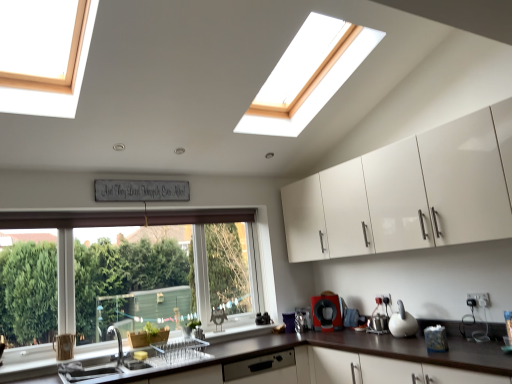
What do you see at coordinates (302, 320) in the screenshot? The width and height of the screenshot is (512, 384). I see `metallic silver kettle at center right, the third appliance viewed from the front` at bounding box center [302, 320].

What do you see at coordinates (371, 347) in the screenshot? The height and width of the screenshot is (384, 512). I see `brown matte countertop at lower left` at bounding box center [371, 347].

Where is `white glossy kettle at right, the third appliance viewed from the back`? white glossy kettle at right, the third appliance viewed from the back is located at coordinates click(x=402, y=323).

From the picture: In order to face black matte coffee maker at lower center, placed as the second appliance when sorted from front to back, should I rotate leftwards or rightwards?

You should look right and rotate roughly 9.421 degrees.

The width and height of the screenshot is (512, 384). What do you see at coordinates (262, 369) in the screenshot? I see `satin silver dishwasher at lower center` at bounding box center [262, 369].

Identify the location of matte stainless steel sink at lower left. (91, 370).

Based on the photo, does white glossy cabinet at upper right have a lesser width compared to matte stainless steel sink at lower left?

Yes.

From the image's perspective, between white glossy cabinet at upper right and matte stainless steel sink at lower left, who is located below?

matte stainless steel sink at lower left.

From the picture: Is white glossy cabinet at upper right looking in the opposite direction of matte stainless steel sink at lower left?

No, white glossy cabinet at upper right is not facing away from matte stainless steel sink at lower left.

Based on the photo, who is bigger, white glossy cabinet at upper right or matte stainless steel sink at lower left?

With larger size is white glossy cabinet at upper right.

From the image's perspective, is clear glass window at lower left below brown matte countertop at lower left?

Actually, clear glass window at lower left appears above brown matte countertop at lower left in the image.

Which is in front, point (48, 218) or point (443, 320)?

Point (443, 320)

Can you confirm if clear glass window at lower left is positioned to the right of brown matte countertop at lower left?

In fact, clear glass window at lower left is to the left of brown matte countertop at lower left.

Measure the distance from clear glass window at lower left to brown matte countertop at lower left.

The distance of clear glass window at lower left from brown matte countertop at lower left is 3.28 feet.

Considering the sizes of objects silver metallic tap at lower left and brown matte countertop at lower left in the image provided, who is bigger, silver metallic tap at lower left or brown matte countertop at lower left?

Bigger between the two is brown matte countertop at lower left.

Is brown matte countertop at lower left completely or partially inside silver metallic tap at lower left?

No, silver metallic tap at lower left does not contain brown matte countertop at lower left.

Considering the relative positions of silver metallic tap at lower left and brown matte countertop at lower left in the image provided, is silver metallic tap at lower left in front of brown matte countertop at lower left?

No, silver metallic tap at lower left is further to the viewer.

Could matte stainless steel sink at lower left be considered to be inside clear glass window at lower left?

No, clear glass window at lower left does not contain matte stainless steel sink at lower left.

Considering the positions of objects clear glass window at lower left and matte stainless steel sink at lower left in the image provided, who is more to the right, clear glass window at lower left or matte stainless steel sink at lower left?

clear glass window at lower left is more to the right.

Who is taller, clear glass window at lower left or matte stainless steel sink at lower left?

Answer: With more height is clear glass window at lower left.

Measure the distance from white glossy cabinet at upper right to white glossy kettle at right, the 3th appliance positioned from the left.

A distance of 33.26 inches exists between white glossy cabinet at upper right and white glossy kettle at right, the 3th appliance positioned from the left.

Does white glossy cabinet at upper right touch white glossy kettle at right, the 3th appliance positioned from the left?

They are not placed beside each other.

Does point (321, 257) come closer to viewer compared to point (407, 314)?

No, (321, 257) is behind (407, 314).

From the image's perspective, between white glossy cabinet at upper right and white glossy kettle at right, the 3th appliance positioned from the left, which one is located above?

white glossy cabinet at upper right.

Which is correct: black matte coffee maker at lower center, which is counted as the second appliance, starting from the left, is inside white glossy cabinet at upper right, or outside of it?

black matte coffee maker at lower center, which is counted as the second appliance, starting from the left, cannot be found inside white glossy cabinet at upper right.

Between point (328, 320) and point (373, 193), which one is positioned in front?

The point (373, 193) is more forward.

Considering their positions, is black matte coffee maker at lower center, placed as the second appliance when sorted from front to back, located in front of or behind white glossy cabinet at upper right?

In the image, black matte coffee maker at lower center, placed as the second appliance when sorted from front to back, appears behind white glossy cabinet at upper right.

How many degrees apart are the facing directions of satin silver dishwasher at lower center and white glossy kettle at right, the third appliance viewed from the back?

The angle between the facing direction of satin silver dishwasher at lower center and the facing direction of white glossy kettle at right, the third appliance viewed from the back, is 93.6 degrees.

Considering the relative sizes of satin silver dishwasher at lower center and white glossy kettle at right, the 3th appliance positioned from the left, in the image provided, is satin silver dishwasher at lower center thinner than white glossy kettle at right, the 3th appliance positioned from the left,?

No.

From a real-world perspective, is satin silver dishwasher at lower center over white glossy kettle at right, which is the first appliance from right to left?

Actually, satin silver dishwasher at lower center is physically below white glossy kettle at right, which is the first appliance from right to left, in the real world.

In the image, there is a white glossy kettle at right, the 3th appliance positioned from the left. At what (x,y) coordinates should I click in order to perform the action: click on dish washer below it (from a real-world perspective). Please return your answer as a coordinate pair (x, y). Image resolution: width=512 pixels, height=384 pixels. Looking at the image, I should click on (262, 369).

Identify the location of sink on the left of white glossy cabinet at upper right. The width and height of the screenshot is (512, 384). (91, 370).

In order to click on window lying above the brown matte countertop at lower left (from the image's perspective) in this screenshot , I will do `click(124, 275)`.

Consider the image. Which object lies further to the anchor point white glossy cabinet at upper right, white glossy kettle at right, the third appliance viewed from the back, or silver metallic tap at lower left?

Based on the image, silver metallic tap at lower left appears to be further to white glossy cabinet at upper right.

Considering their positions, is metallic silver kettle at center right, acting as the third appliance starting from the right, positioned closer to white glossy cabinet at upper right than satin silver dishwasher at lower center?

satin silver dishwasher at lower center is closer to white glossy cabinet at upper right.

Which object lies nearer to the anchor point silver metallic tap at lower left, black matte coffee maker at lower center, placed as the second appliance when sorted from front to back, or white glossy cabinet at upper right?

black matte coffee maker at lower center, placed as the second appliance when sorted from front to back, is positioned closer to the anchor silver metallic tap at lower left.

When comparing their distances from black matte coffee maker at lower center, placed as the second appliance when sorted from back to front, does white glossy cabinet at upper right or white glossy kettle at right, the 3th appliance positioned from the left, seem further?

white glossy cabinet at upper right is positioned further to the anchor black matte coffee maker at lower center, placed as the second appliance when sorted from back to front.

Considering their positions, is clear glass window at lower left positioned further to silver metallic tap at lower left than matte stainless steel sink at lower left?

clear glass window at lower left is further to silver metallic tap at lower left.

Looking at the image, which one is located further to black matte coffee maker at lower center, which is counted as the second appliance, starting from the left, white glossy kettle at right, which is the first appliance from right to left, or satin silver dishwasher at lower center?

white glossy kettle at right, which is the first appliance from right to left, is further to black matte coffee maker at lower center, which is counted as the second appliance, starting from the left.

Estimate the real-world distances between objects in this image. Which object is closer to white glossy cabinet at upper right, brown matte countertop at lower left or silver metallic tap at lower left?

brown matte countertop at lower left is positioned closer to the anchor white glossy cabinet at upper right.

From the image, which object appears to be nearer to satin silver dishwasher at lower center, silver metallic tap at lower left or brown matte countertop at lower left?

brown matte countertop at lower left.

The width and height of the screenshot is (512, 384). Identify the location of dish washer situated between silver metallic tap at lower left and white glossy cabinet at upper right from left to right. (262, 369).

At what (x,y) coordinates should I click in order to perform the action: click on window between silver metallic tap at lower left and satin silver dishwasher at lower center. Please return your answer as a coordinate pair (x, y). The image size is (512, 384). Looking at the image, I should click on (124, 275).

At what (x,y) coordinates should I click in order to perform the action: click on cabinetry between brown matte countertop at lower left and white glossy kettle at right, which is the 1th appliance in front-to-back order, from left to right. Please return your answer as a coordinate pair (x, y). The height and width of the screenshot is (384, 512). Looking at the image, I should click on (409, 193).

The height and width of the screenshot is (384, 512). I want to click on countertop between silver metallic tap at lower left and white glossy cabinet at upper right, so click(x=371, y=347).